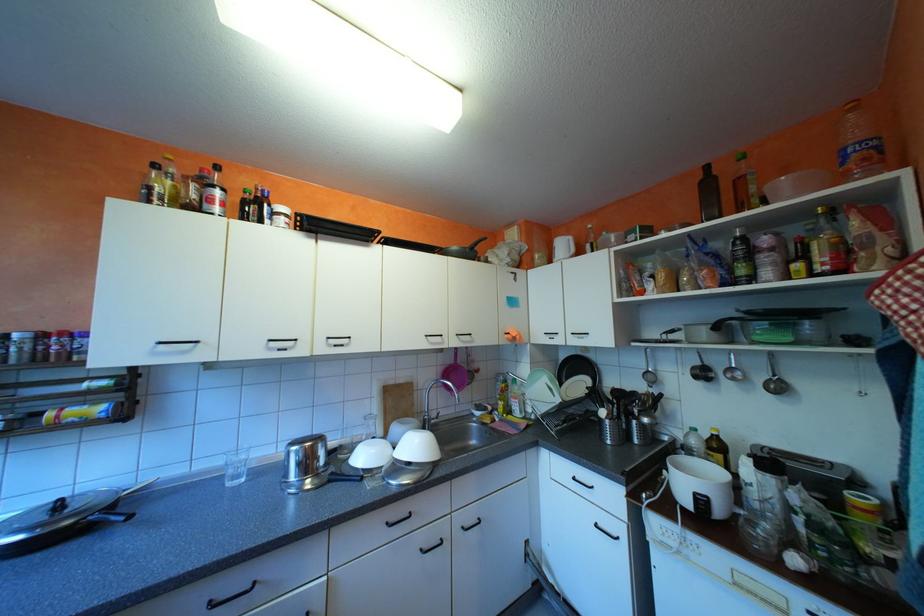
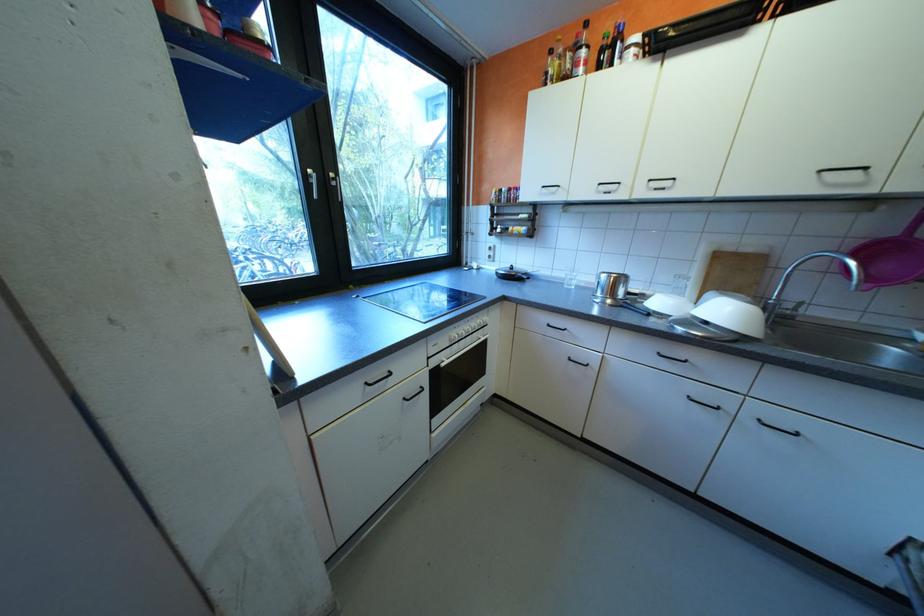
Where in the second image is the point corresponding to the point at 427,445 from the first image?

(736, 312)